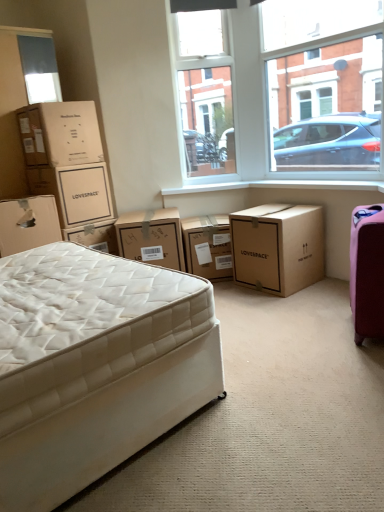
Question: Is matte brown cardboard box at upper left, placed as the 4th box when sorted from right to left, taller than brown cardboard box at upper left, which is the fifth box in right-to-left order?

Choices:
 (A) no
 (B) yes

Answer: (A)

Question: From the image's perspective, does matte brown cardboard box at upper left, placed as the 4th box when sorted from right to left, appear lower than brown cardboard box at upper left, which is the fifth box in right-to-left order?

Choices:
 (A) no
 (B) yes

Answer: (B)

Question: Is matte brown cardboard box at upper left, placed as the 4th box when sorted from right to left, facing towards brown cardboard box at upper left, which is the 2th box in left-to-right order?

Choices:
 (A) yes
 (B) no

Answer: (B)

Question: Can brown cardboard box at upper left, which is the 2th box in left-to-right order, be found inside matte brown cardboard box at upper left, placed as the 4th box when sorted from right to left?

Choices:
 (A) yes
 (B) no

Answer: (B)

Question: Are matte brown cardboard box at upper left, acting as the third box starting from the left, and brown cardboard box at upper left, which is the fifth box in right-to-left order, beside each other?

Choices:
 (A) no
 (B) yes

Answer: (A)

Question: In the image, is white smooth window sill at center positioned in front of or behind clear glass window at upper center?

Choices:
 (A) front
 (B) behind

Answer: (B)

Question: Based on their sizes in the image, would you say white smooth window sill at center is bigger or smaller than clear glass window at upper center?

Choices:
 (A) small
 (B) big

Answer: (A)

Question: From a real-world perspective, is white smooth window sill at center positioned above or below clear glass window at upper center?

Choices:
 (A) above
 (B) below

Answer: (B)

Question: In terms of width, does white smooth window sill at center look wider or thinner when compared to clear glass window at upper center?

Choices:
 (A) wide
 (B) thin

Answer: (A)

Question: Relative to brown cardboard box at center, the 5th box positioned from the left, is transparent glass window at upper center in front or behind?

Choices:
 (A) front
 (B) behind

Answer: (B)

Question: From their relative heights in the image, would you say transparent glass window at upper center is taller or shorter than brown cardboard box at center, the 5th box positioned from the left?

Choices:
 (A) tall
 (B) short

Answer: (A)

Question: Is transparent glass window at upper center bigger or smaller than brown cardboard box at center, the 5th box positioned from the left?

Choices:
 (A) small
 (B) big

Answer: (A)

Question: From a real-world perspective, is transparent glass window at upper center above or below brown cardboard box at center, the 5th box positioned from the left?

Choices:
 (A) above
 (B) below

Answer: (A)

Question: From the image's perspective, relative to brown cardboard box at center, arranged as the 4th box when viewed from the left, is matte brown cardboard box at upper left, acting as the third box starting from the left, above or below?

Choices:
 (A) below
 (B) above

Answer: (B)

Question: Would you say matte brown cardboard box at upper left, placed as the 4th box when sorted from right to left, is to the left or to the right of brown cardboard box at center, which appears as the 3th box when viewed from the right, in the picture?

Choices:
 (A) right
 (B) left

Answer: (B)